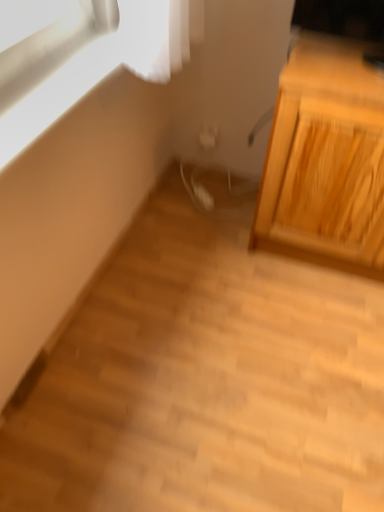
You are a GUI agent. You are given a task and a screenshot of the screen. Output one action in this format:
    pyautogui.click(x=<x>, y=<y>)
    Task: Click on the free point below matte white window at upper left (from a real-world perspective)
    The image size is (384, 512).
    Given the screenshot: What is the action you would take?
    pyautogui.click(x=104, y=290)